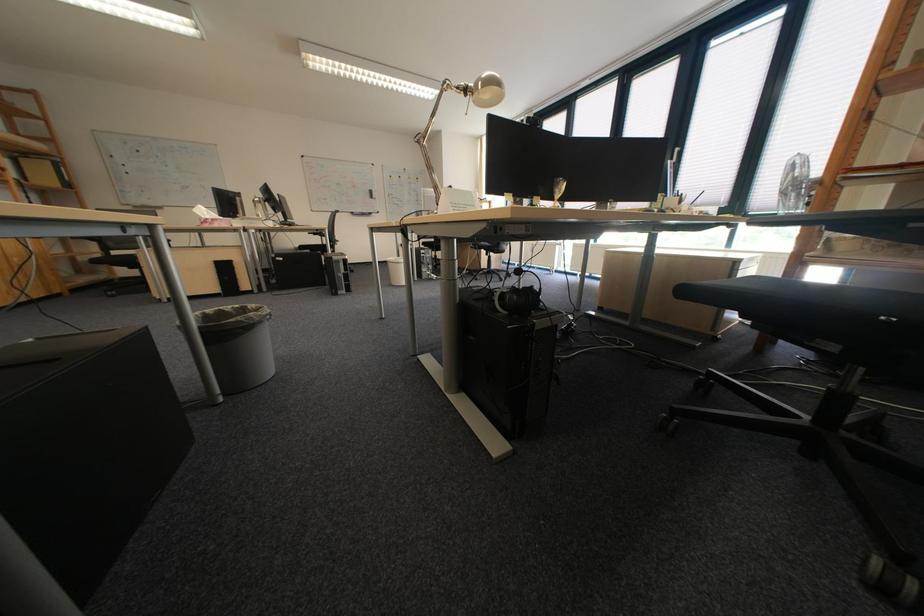
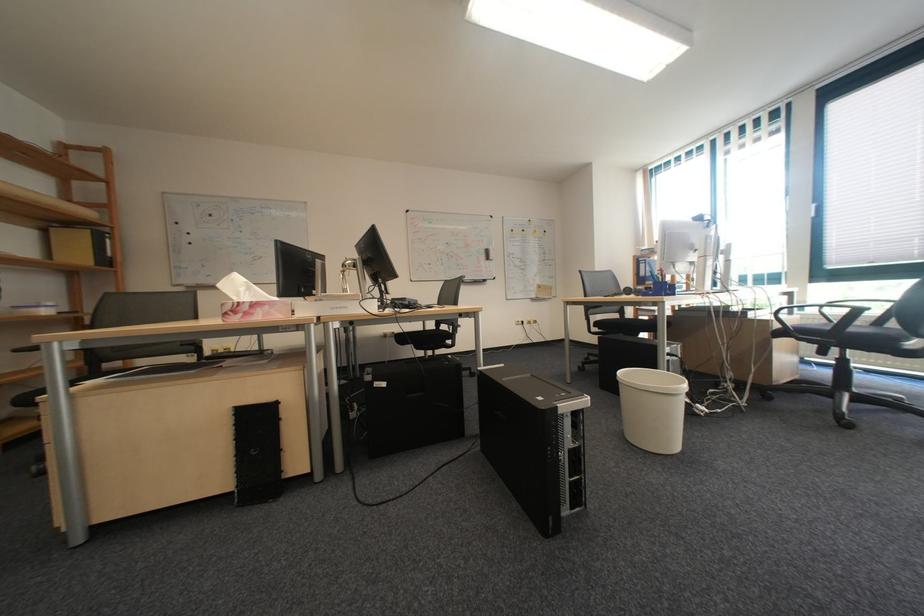
Locate, in the second image, the point that corresponds to (296,261) in the first image.

(398, 386)